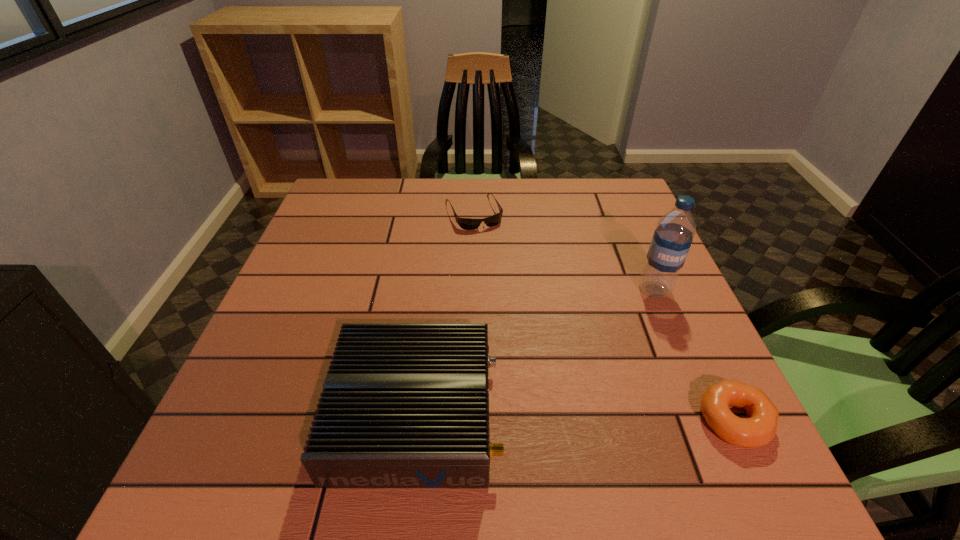
Image resolution: width=960 pixels, height=540 pixels. What are the coordinates of `vacant space on the desktop that is between the second tallest object and the third tallest object and is positioned on the front-facing side of the sunglasses` in the screenshot? It's located at (576, 417).

I want to click on vacant space on the desktop that is between the router and the second shortest object and is positioned on the label of the third nearest object, so click(x=610, y=417).